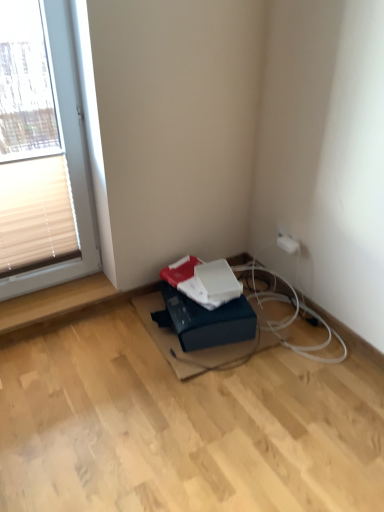
Question: From their relative heights in the image, would you say blue cardboard box at lower center is taller or shorter than black rubber cable at lower center?

Choices:
 (A) tall
 (B) short

Answer: (A)

Question: Would you say blue cardboard box at lower center is to the left or to the right of black rubber cable at lower center in the picture?

Choices:
 (A) right
 (B) left

Answer: (B)

Question: Which of these objects is positioned closest to the white plastic window at upper left?

Choices:
 (A) white matte paperback book at center
 (B) blue cardboard box at lower center
 (C) white plastic electric outlet at upper right
 (D) black rubber cable at lower center
 (E) beige fabric blind at left

Answer: (E)

Question: Which object is positioned closest to the blue cardboard box at lower center?

Choices:
 (A) black rubber cable at lower center
 (B) white matte paperback book at center
 (C) beige fabric blind at left
 (D) white plastic window at upper left
 (E) white plastic electric outlet at upper right

Answer: (B)